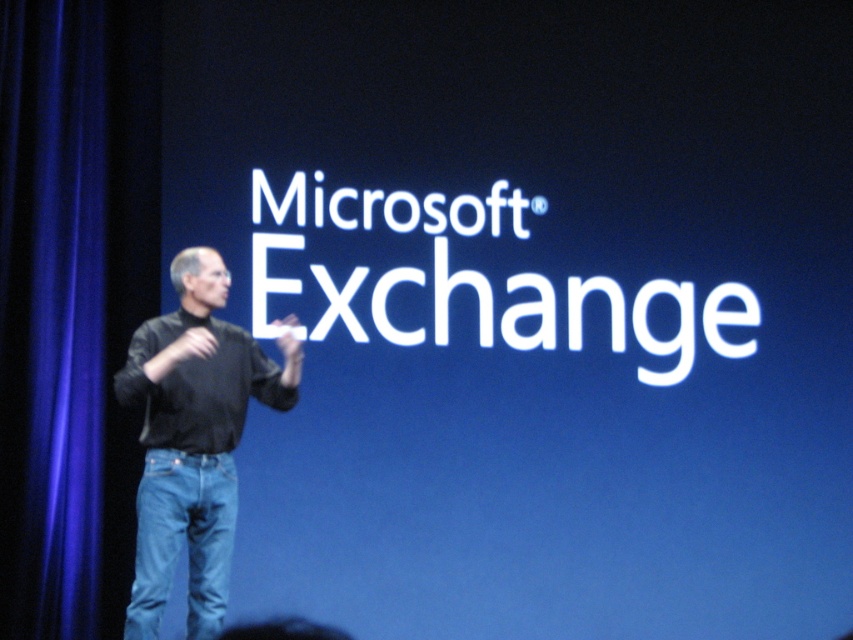
Question: Does blue velvet curtain at left appear over black matte shirt at center?

Choices:
 (A) no
 (B) yes

Answer: (B)

Question: Is blue velvet curtain at left below black matte shirt at center?

Choices:
 (A) yes
 (B) no

Answer: (B)

Question: Which point appears farthest from the camera in this image?

Choices:
 (A) (122, 392)
 (B) (61, 605)

Answer: (B)

Question: Which of the following is the closest to the observer?

Choices:
 (A) (0, 26)
 (B) (247, 346)

Answer: (B)

Question: Which object appears farthest from the camera in this image?

Choices:
 (A) black matte shirt at center
 (B) blue velvet curtain at left

Answer: (B)

Question: Observing the image, what is the correct spatial positioning of blue velvet curtain at left in reference to black matte shirt at center?

Choices:
 (A) right
 (B) left

Answer: (B)